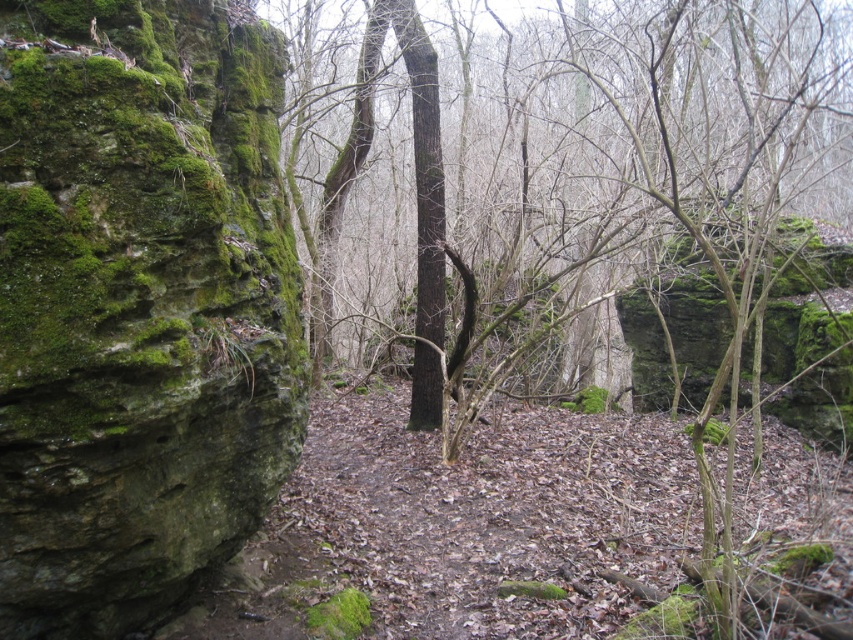
Question: Which object is closer to the camera taking this photo?

Choices:
 (A) green mossy rock at left
 (B) green mossy tree at center

Answer: (A)

Question: Which point is closer to the camera?

Choices:
 (A) (628, 300)
 (B) (85, 289)

Answer: (B)

Question: Among these objects, which one is farthest from the camera?

Choices:
 (A) green mossy tree at center
 (B) green mossy rock at left

Answer: (A)

Question: Can you confirm if green mossy tree at center is positioned below green mossy rock at left?

Choices:
 (A) no
 (B) yes

Answer: (A)

Question: Is green mossy tree at center wider than green mossy rock at left?

Choices:
 (A) yes
 (B) no

Answer: (A)

Question: In this image, where is green mossy tree at center located relative to green mossy rock at left?

Choices:
 (A) above
 (B) below

Answer: (A)